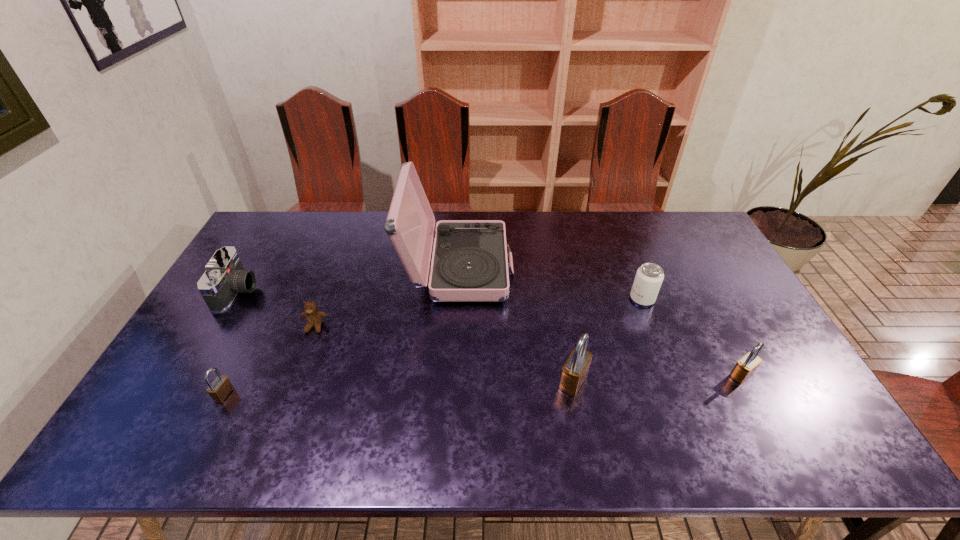
Where is `padlock present at the left edge`? The width and height of the screenshot is (960, 540). padlock present at the left edge is located at coordinates click(220, 388).

Find the location of a particular element. The width and height of the screenshot is (960, 540). camera that is positioned at the left edge is located at coordinates (224, 277).

Locate an element on the screen. This screenshot has height=540, width=960. object present at the right edge is located at coordinates (746, 366).

The height and width of the screenshot is (540, 960). I want to click on object that is positioned at the near left corner, so click(220, 388).

Image resolution: width=960 pixels, height=540 pixels. Find the location of `object that is at the near right corner`. object that is at the near right corner is located at coordinates (746, 366).

The image size is (960, 540). I want to click on blank area at the far edge, so click(339, 239).

The image size is (960, 540). In the image, there is a desktop. What are the coordinates of `free region at the near edge` in the screenshot? It's located at (x=642, y=409).

Where is `vacant space at the left edge of the desktop`? The height and width of the screenshot is (540, 960). vacant space at the left edge of the desktop is located at coordinates (200, 328).

Where is `blank space at the right edge of the desktop`? The height and width of the screenshot is (540, 960). blank space at the right edge of the desktop is located at coordinates (709, 313).

Image resolution: width=960 pixels, height=540 pixels. In order to click on vacant space at the far left corner of the desktop in this screenshot , I will do `click(294, 243)`.